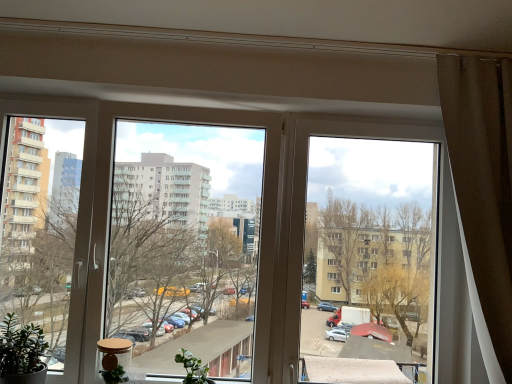
Question: Which direction should I rotate to look at transparent plastic window at center, the 1th window when ordered from left to right, — up or down?

Choices:
 (A) down
 (B) up

Answer: (A)

Question: From a real-world perspective, is brown fabric curtain at right physically below green matte plant at lower left, placed as the second plant when sorted from right to left?

Choices:
 (A) yes
 (B) no

Answer: (B)

Question: From a real-world perspective, is brown fabric curtain at right on top of green matte plant at lower left, placed as the second plant when sorted from right to left?

Choices:
 (A) no
 (B) yes

Answer: (B)

Question: Is there a large distance between brown fabric curtain at right and green matte plant at lower left, arranged as the first plant when viewed from the left?

Choices:
 (A) no
 (B) yes

Answer: (B)

Question: Can you confirm if brown fabric curtain at right is smaller than green matte plant at lower left, arranged as the first plant when viewed from the left?

Choices:
 (A) no
 (B) yes

Answer: (A)

Question: Is brown fabric curtain at right wider than green matte plant at lower left, arranged as the first plant when viewed from the left?

Choices:
 (A) no
 (B) yes

Answer: (B)

Question: From the image's perspective, is brown fabric curtain at right over green matte plant at lower left, placed as the second plant when sorted from right to left?

Choices:
 (A) no
 (B) yes

Answer: (B)

Question: Considering the relative sizes of green matte plant at lower center, which appears as the 2th plant when viewed from the left, and green matte plant at lower left, placed as the second plant when sorted from right to left, in the image provided, is green matte plant at lower center, which appears as the 2th plant when viewed from the left, shorter than green matte plant at lower left, placed as the second plant when sorted from right to left,?

Choices:
 (A) no
 (B) yes

Answer: (B)

Question: From a real-world perspective, is green matte plant at lower center, which appears as the 2th plant when viewed from the left, on top of green matte plant at lower left, arranged as the first plant when viewed from the left?

Choices:
 (A) no
 (B) yes

Answer: (A)

Question: From a real-world perspective, is green matte plant at lower center, marked as the first plant in a right-to-left arrangement, below green matte plant at lower left, placed as the second plant when sorted from right to left?

Choices:
 (A) yes
 (B) no

Answer: (A)

Question: Can you confirm if green matte plant at lower center, marked as the first plant in a right-to-left arrangement, is bigger than green matte plant at lower left, placed as the second plant when sorted from right to left?

Choices:
 (A) yes
 (B) no

Answer: (B)

Question: Is green matte plant at lower center, marked as the first plant in a right-to-left arrangement, oriented towards green matte plant at lower left, arranged as the first plant when viewed from the left?

Choices:
 (A) yes
 (B) no

Answer: (B)

Question: Would you say green matte plant at lower center, which appears as the 2th plant when viewed from the left, is outside green matte plant at lower left, placed as the second plant when sorted from right to left?

Choices:
 (A) yes
 (B) no

Answer: (A)

Question: Would you consider brown fabric curtain at right to be distant from transparent plastic window at center, the 1th window when ordered from left to right?

Choices:
 (A) no
 (B) yes

Answer: (B)